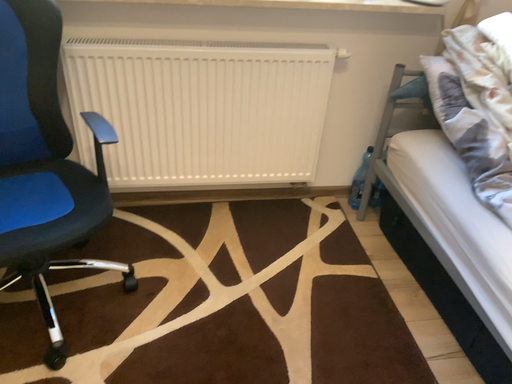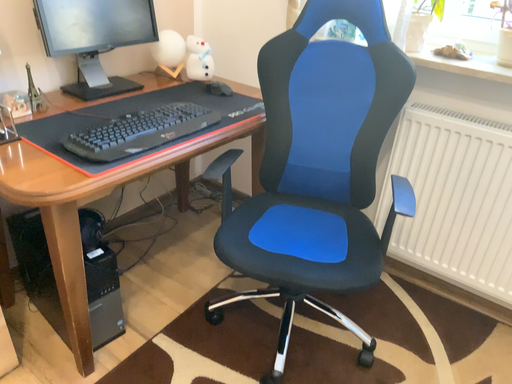
Question: How did the camera likely rotate when shooting the video?

Choices:
 (A) rotated left
 (B) rotated right

Answer: (A)